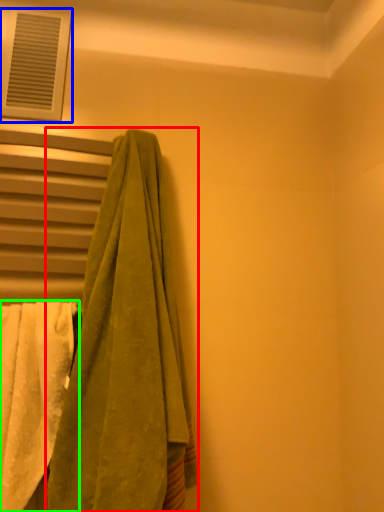
Question: Based on their relative distances, which object is farther from towel (highlighted by a red box)? Choose from window (highlighted by a blue box) and towel (highlighted by a green box).

Choices:
 (A) window
 (B) towel

Answer: (A)